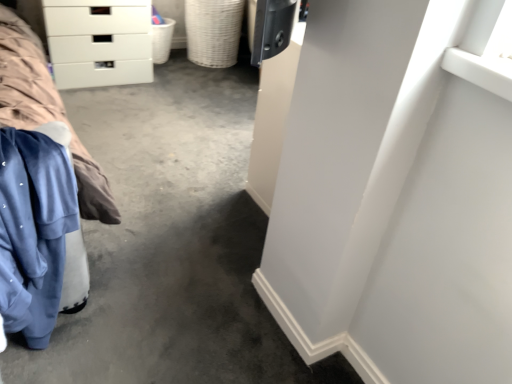
At what (x,y) coordinates should I click in order to perform the action: click on spots to the right of blue fleece at left. Please return your answer as a coordinate pair (x, y). The height and width of the screenshot is (384, 512). Looking at the image, I should click on (136, 329).